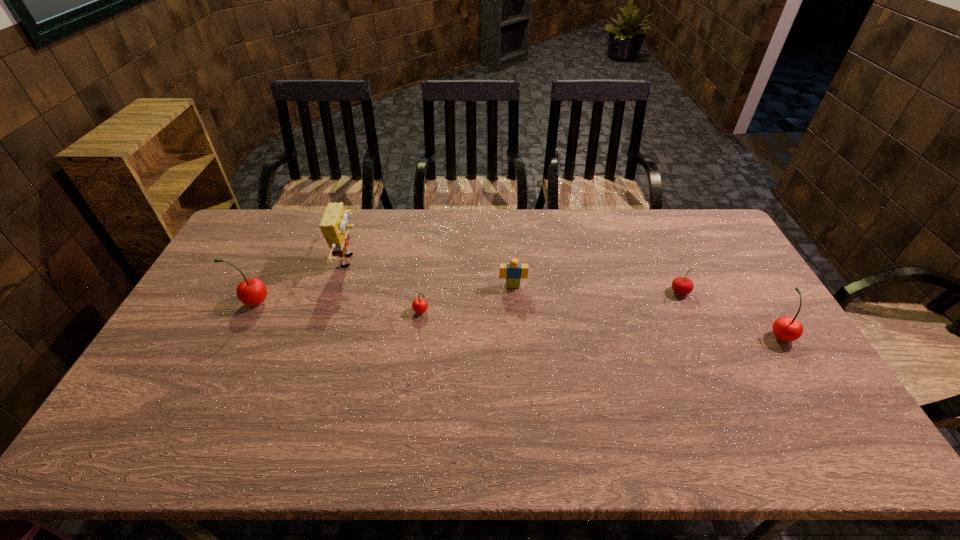
Where is `the leftmost cherry`? the leftmost cherry is located at coordinates coord(252,291).

The height and width of the screenshot is (540, 960). I want to click on the third object from left to right, so click(419, 305).

Locate an element on the screen. Image resolution: width=960 pixels, height=540 pixels. the rightmost cherry is located at coordinates (785, 328).

Where is `the nearest cherry`? The width and height of the screenshot is (960, 540). the nearest cherry is located at coordinates tap(785, 328).

Locate an element on the screen. The width and height of the screenshot is (960, 540). the third cherry from left to right is located at coordinates coord(681,285).

The image size is (960, 540). Find the location of `the fifth object from right to left`. the fifth object from right to left is located at coordinates (333, 225).

Image resolution: width=960 pixels, height=540 pixels. I want to click on Lego, so click(513, 272).

Identify the location of free spot located on the front of the leftmost object. Image resolution: width=960 pixels, height=540 pixels. (219, 370).

Where is `free space located 0.070m on the left of the third cherry from right to left`? free space located 0.070m on the left of the third cherry from right to left is located at coordinates (390, 313).

Where is `vacant position located on the left of the fourth shortest object`? Image resolution: width=960 pixels, height=540 pixels. vacant position located on the left of the fourth shortest object is located at coordinates (750, 335).